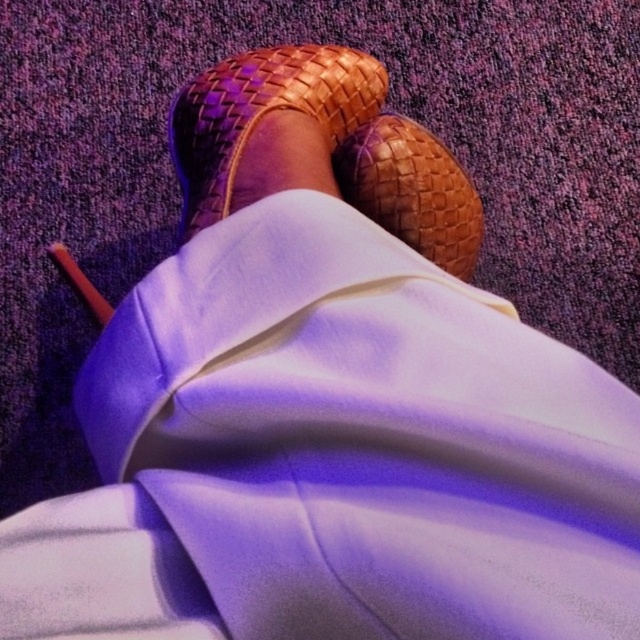
You are a fashion designer analyzing footwear in an image. You notice two items labeled as brown woven sandal at center and brown woven shoe at center. Which one is positioned higher on the person?

The brown woven sandal at center is located above the brown woven shoe at center, so the sandal is positioned higher on the person.

You are a photographer setting up a shoot and need to position a prop between the brown woven sandal at center and the brown woven shoe at center. Based on their positions, which side should you place the prop to ensure it is between them?

The brown woven sandal at center is to the left of brown woven shoe at center, so placing the prop between them would require positioning it to the right of the sandal and to the left of the shoe.